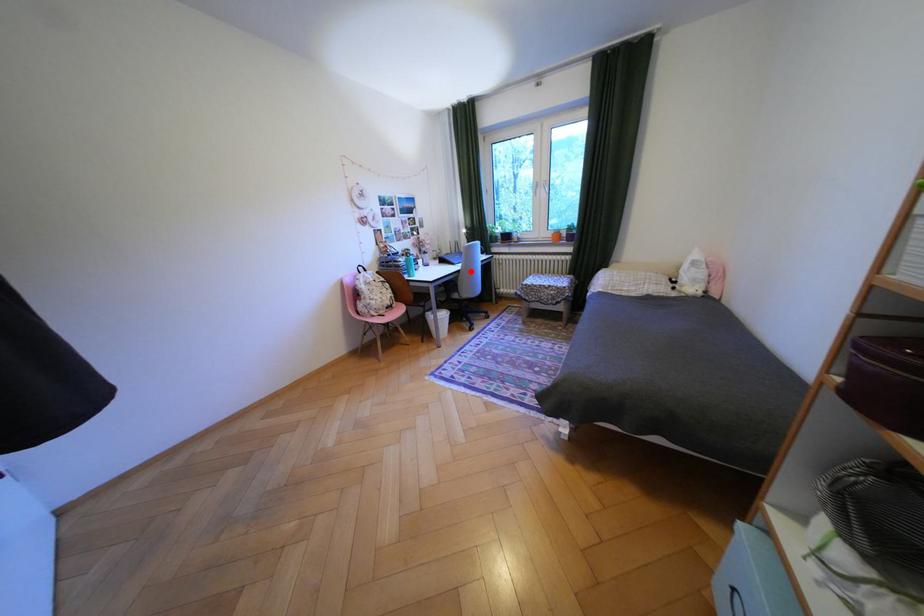
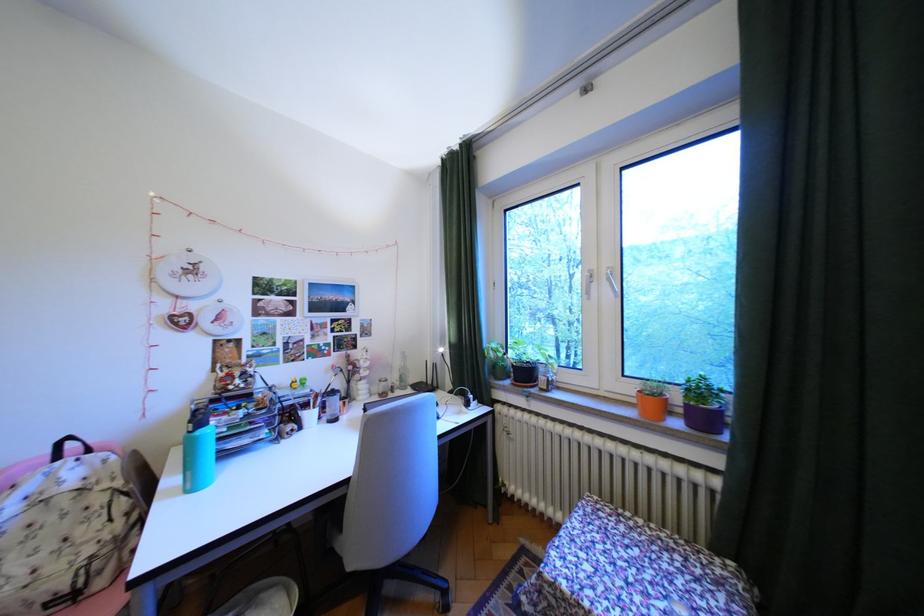
Where in the second image is the point corresponding to the highlighted location from the first image?

(359, 483)